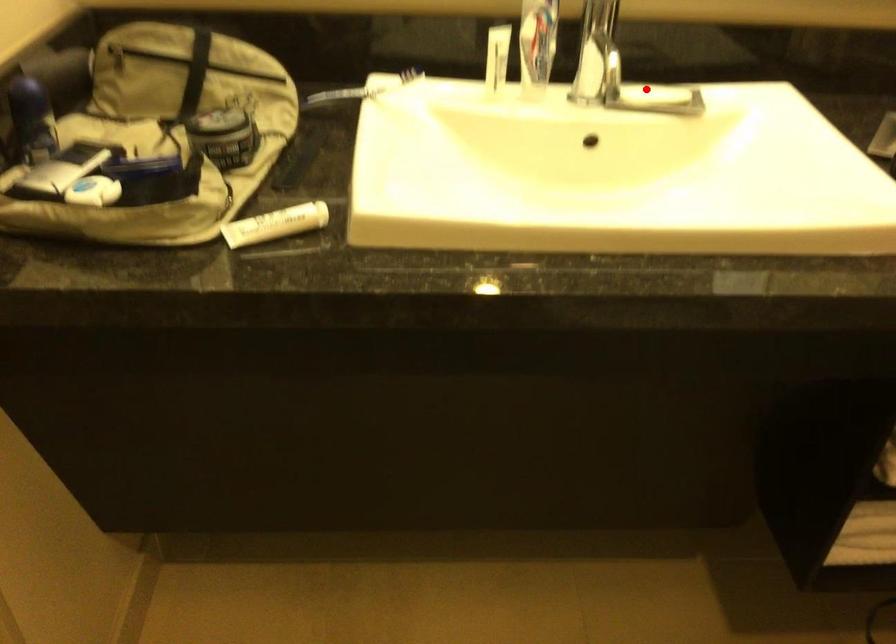
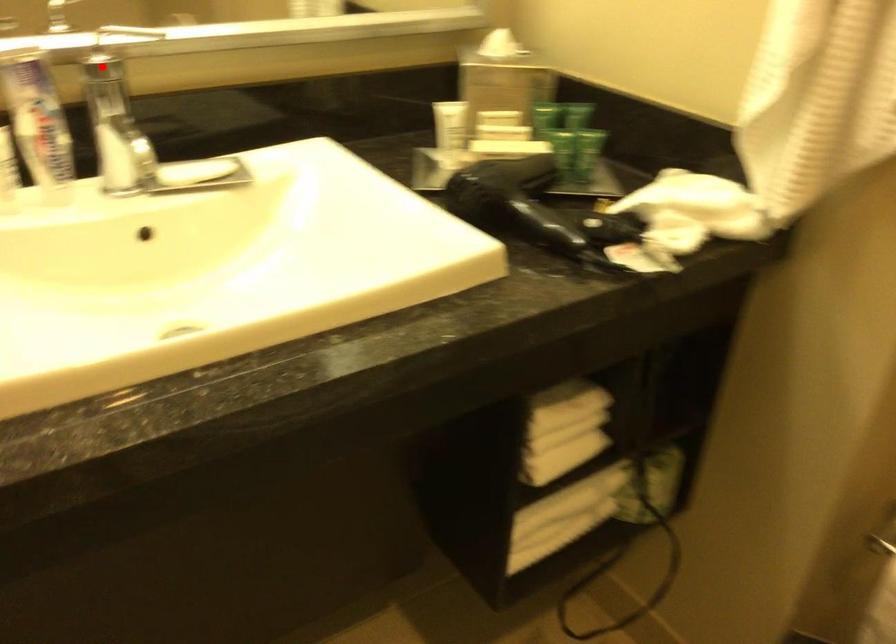
I am providing you with two images of the same scene from different viewpoints. A red point is marked on the first image and another point is marked on the second image. Does the point marked in image1 correspond to the same location as the one in image2?

No